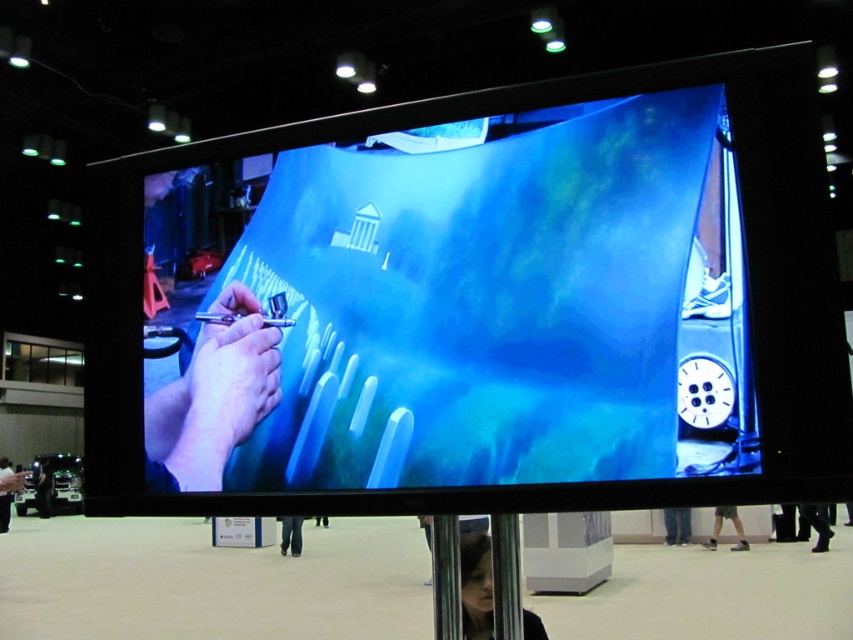
You are an attendee at the exhibition and want to take a photo of the black fabric at lower right and the black leather pants at lower center. Which one should you focus on first to ensure they are both in clear view?

The black fabric at lower right is further to the viewer than the black leather pants at lower center, so you should focus on the black fabric at lower right first to ensure both are in clear view.

You are an artist trying to determine the best position to view the screen. Considering the smooth skin hands at center and the black fabric at lower right, which object appears narrower from your current viewpoint?

The smooth skin hands at center appears narrower than the black fabric at lower right from your current viewpoint.

You are standing in front of the large screen and want to determine the relative positions of two points displayed on the screen. The first point is labeled as point (212,442) and the second is point (828,541). Based on the screen display, which point appears closer to you?

Point (212,442) is closer to the viewer than point (828,541).